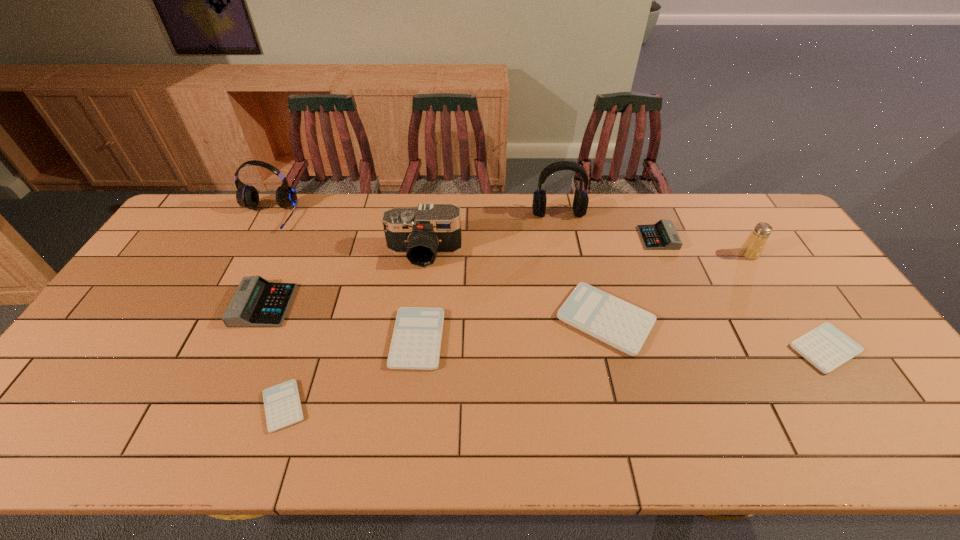
The height and width of the screenshot is (540, 960). I want to click on blank region between the saltshaker and the fifth calculator from left to right, so click(x=704, y=246).

Identify the location of empty space that is in between the second white calculator from left to right and the sixth shortest object. The image size is (960, 540). (341, 322).

The image size is (960, 540). I want to click on empty space between the second shortest calculator and the fourth tallest object, so click(787, 301).

The width and height of the screenshot is (960, 540). Find the location of `empty space that is in between the fifth shortest object and the saltshaker`. empty space that is in between the fifth shortest object and the saltshaker is located at coordinates (704, 246).

Identify the location of free point between the third white calculator from left to right and the right headset. (582, 266).

Select which object is the closest to the biggest white calculator. Please provide its 2D coordinates. Your answer should be formatted as a tuple, i.e. [(x, y)], where the tuple contains the x and y coordinates of a point satisfying the conditions above.

[(662, 235)]

Identify which object is the seventh nearest to the leftmost calculator. Please provide its 2D coordinates. Your answer should be formatted as a tuple, i.e. [(x, y)], where the tuple contains the x and y coordinates of a point satisfying the conditions above.

[(662, 235)]

Where is `the closest calculator to the camera`? the closest calculator to the camera is located at coordinates (416, 341).

In order to click on calculator identified as the fifth closest to the ninth tallest object in this screenshot , I will do `click(257, 302)`.

At what (x,y) coordinates should I click in order to perform the action: click on the second closest white calculator to the saltshaker. Please return your answer as a coordinate pair (x, y). Looking at the image, I should click on (624, 326).